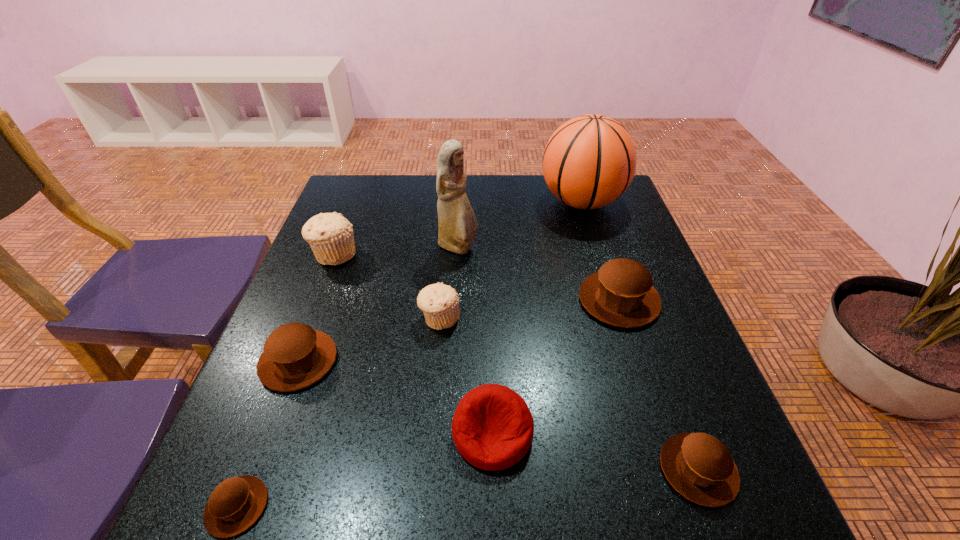
Identify the location of vacant region located on the seat area of the beanbag. This screenshot has width=960, height=540. (494, 526).

Find the location of a particular element. The width and height of the screenshot is (960, 540). blank area located 0.210m on the back of the second shortest object is located at coordinates (650, 340).

Identify the location of vacant position located 0.050m on the right of the shortest object. Image resolution: width=960 pixels, height=540 pixels. (300, 507).

The width and height of the screenshot is (960, 540). In order to click on object positioned at the far edge in this screenshot , I will do `click(589, 161)`.

At what (x,y) coordinates should I click in order to perform the action: click on basketball located at the right edge. Please return your answer as a coordinate pair (x, y). Looking at the image, I should click on (589, 161).

This screenshot has height=540, width=960. I want to click on object that is at the near left corner, so click(235, 505).

Find the location of `object that is at the far right corner`. object that is at the far right corner is located at coordinates (589, 161).

Identify the location of object situated at the near right corner. (698, 466).

Find the location of a particular element. vacant space at the far edge is located at coordinates (557, 213).

Image resolution: width=960 pixels, height=540 pixels. In order to click on free region at the near edge in this screenshot , I will do `click(485, 496)`.